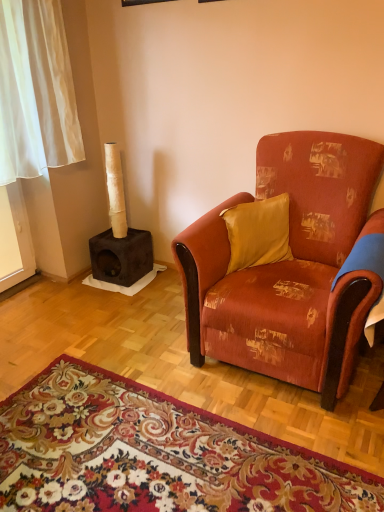
Question: Which is correct: dark brown suede cat tree at left is inside satin yellow pillow at center, or outside of it?

Choices:
 (A) outside
 (B) inside

Answer: (A)

Question: Based on their positions, is dark brown suede cat tree at left located to the left or right of satin yellow pillow at center?

Choices:
 (A) left
 (B) right

Answer: (A)

Question: Estimate the real-world distances between objects in this image. Which object is farther from the textured orange fabric armchair at center?

Choices:
 (A) satin yellow pillow at center
 (B) floral carpet at lower center
 (C) dark brown suede cat tree at left

Answer: (C)

Question: Based on their relative distances, which object is farther from the satin yellow pillow at center?

Choices:
 (A) textured orange fabric armchair at center
 (B) floral carpet at lower center
 (C) dark brown suede cat tree at left

Answer: (C)